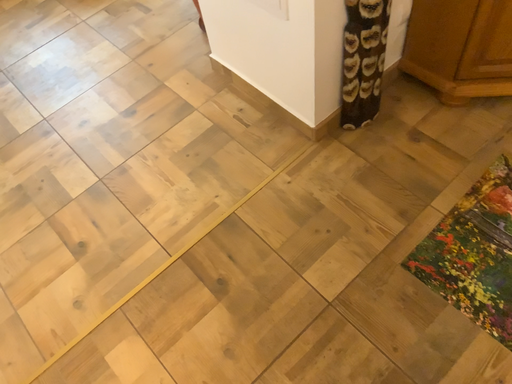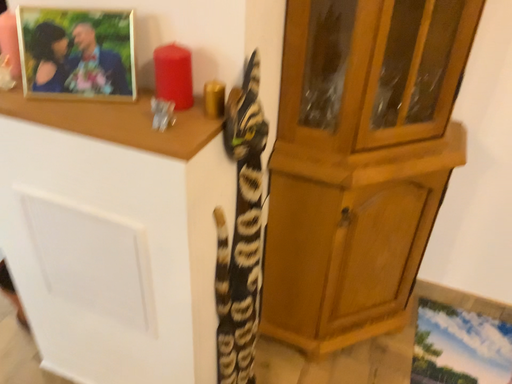
Question: How did the camera likely rotate when shooting the video?

Choices:
 (A) rotated downward
 (B) rotated upward

Answer: (B)